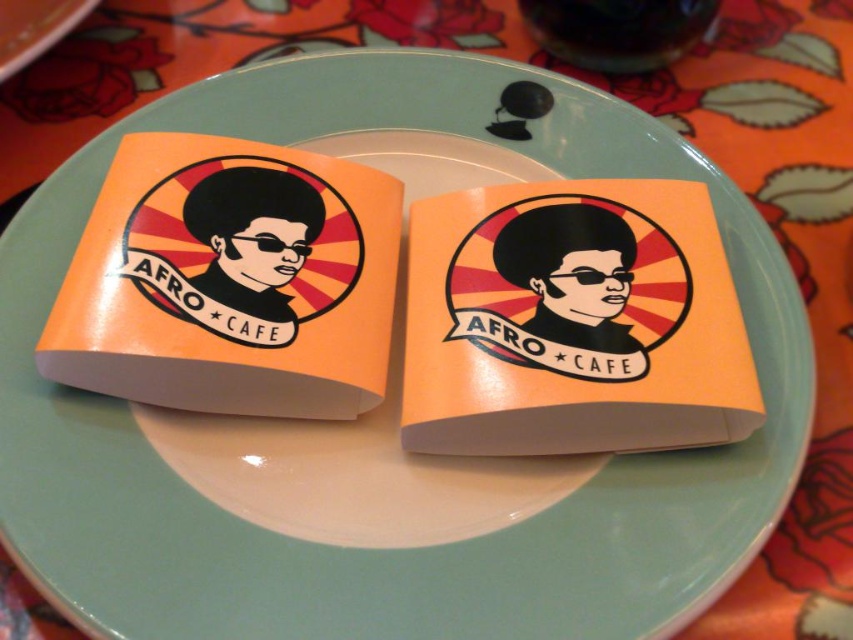
Question: Does orange glossy sticker at center have a larger size compared to orange paper napkin at center?

Choices:
 (A) yes
 (B) no

Answer: (A)

Question: Which of these objects is positioned closest to the orange paper napkin at center?

Choices:
 (A) orange matte sticker at center
 (B) orange glossy sticker at center

Answer: (B)

Question: Based on their relative distances, which object is nearer to the orange paper napkin at center?

Choices:
 (A) orange matte sticker at center
 (B) orange glossy sticker at center

Answer: (B)

Question: Which point is closer to the camera?

Choices:
 (A) orange paper napkin at center
 (B) orange matte sticker at center
 (C) orange glossy sticker at center

Answer: (C)

Question: Is orange matte sticker at center further to the viewer compared to orange paper napkin at center?

Choices:
 (A) no
 (B) yes

Answer: (A)

Question: Does orange glossy sticker at center appear over orange paper napkin at center?

Choices:
 (A) no
 (B) yes

Answer: (A)